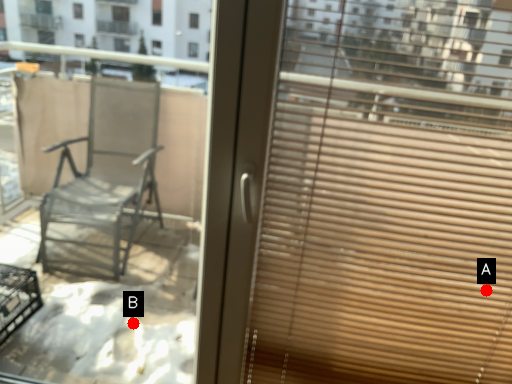
Question: Two points are circled on the image, labeled by A and B beside each circle. Which of the following is the farthest from the observer?

Choices:
 (A) A is further
 (B) B is further

Answer: (B)